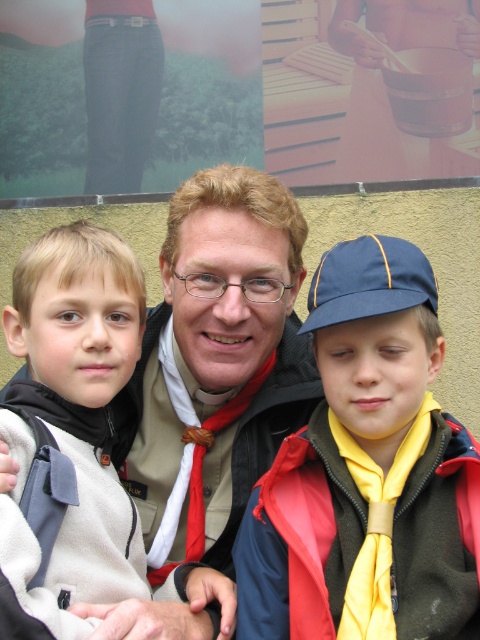
Question: Among these objects, which one is nearest to the camera?

Choices:
 (A) metallic silver pot at upper center
 (B) light brown hair at left

Answer: (B)

Question: Is light brown hair at left positioned at the back of metallic silver pot at upper center?

Choices:
 (A) no
 (B) yes

Answer: (A)

Question: Based on their relative distances, which object is farther from the metallic silver pot at upper center?

Choices:
 (A) yellow matte scarf at center
 (B) light brown hair at left

Answer: (B)

Question: Can you confirm if light brown hair at left is thinner than metallic silver pot at upper center?

Choices:
 (A) no
 (B) yes

Answer: (B)

Question: Which point is farther to the camera?

Choices:
 (A) (72, 326)
 (B) (326, 353)
 (C) (340, 45)

Answer: (C)

Question: Does light brown hair at left come in front of metallic silver pot at upper center?

Choices:
 (A) no
 (B) yes

Answer: (B)